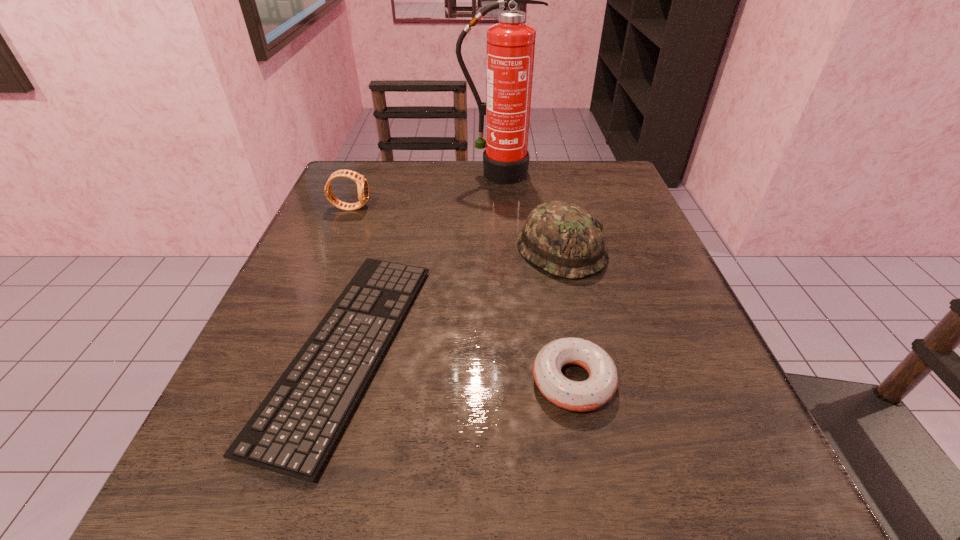
I want to click on free spot between the computer keyboard and the watch, so [x=349, y=278].

Where is `free spot between the watch and the headwear`? The height and width of the screenshot is (540, 960). free spot between the watch and the headwear is located at coordinates (456, 229).

Where is `empty space that is in between the headwear and the watch`? The width and height of the screenshot is (960, 540). empty space that is in between the headwear and the watch is located at coordinates (456, 229).

Locate an element on the screen. The height and width of the screenshot is (540, 960). vacant point located between the computer keyboard and the headwear is located at coordinates (455, 300).

I want to click on free spot between the shortest object and the doughnut, so click(461, 364).

You are a GUI agent. You are given a task and a screenshot of the screen. Output one action in this format:
    pyautogui.click(x=<x>, y=<y>)
    Task: Click on the free space between the second farthest object and the shortest object
    This screenshot has width=960, height=540.
    Given the screenshot: What is the action you would take?
    pyautogui.click(x=349, y=278)

Where is `empty location between the second farthest object and the headwear`? Image resolution: width=960 pixels, height=540 pixels. empty location between the second farthest object and the headwear is located at coordinates (456, 229).

Where is `vacant space that is in between the farthest object and the doughnut`? The height and width of the screenshot is (540, 960). vacant space that is in between the farthest object and the doughnut is located at coordinates (535, 278).

Identify which object is located as the second nearest to the farthest object. Please provide its 2D coordinates. Your answer should be formatted as a tuple, i.e. [(x, y)], where the tuple contains the x and y coordinates of a point satisfying the conditions above.

[(362, 185)]

Where is `the third closest object to the farthest object`? Image resolution: width=960 pixels, height=540 pixels. the third closest object to the farthest object is located at coordinates (292, 432).